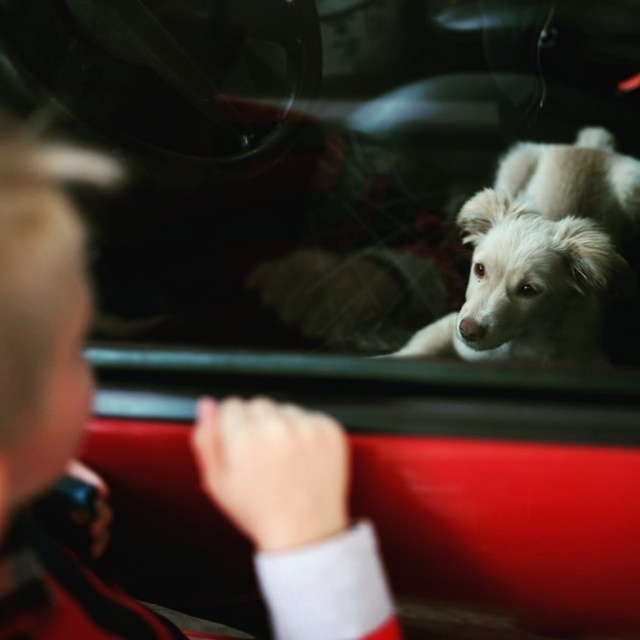
In the scene shown: You are sitting in the car and want to reach a point that is 20.44 inches away from you. The point is labeled as point (22, 516). Can you reach it without moving your seat?

The distance between you and point (22, 516) is 20.44 inches. Whether you can reach it depends on your arm length. If your arm is longer than 20.44 inches, then yes, otherwise no.

You are a passenger in the car and want to know which object takes up more space in the front part of the car. Which one has a larger width between the blonde hair at upper left and the white fluffy dog at center?

The white fluffy dog at center has a greater width compared to the blonde hair at upper left, so it takes up more space in the front part of the car.